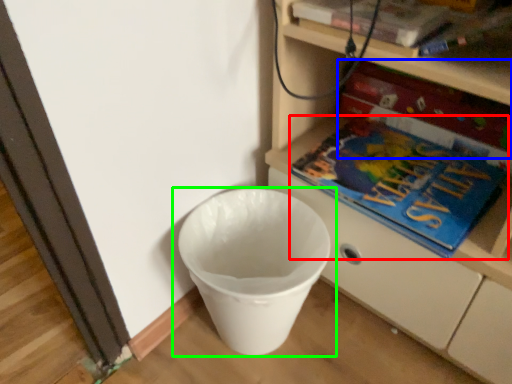
Question: Which object is the closest to the book (highlighted by a red box)? Choose among these: paperback book (highlighted by a blue box) or waste container (highlighted by a green box).

Choices:
 (A) paperback book
 (B) waste container

Answer: (A)